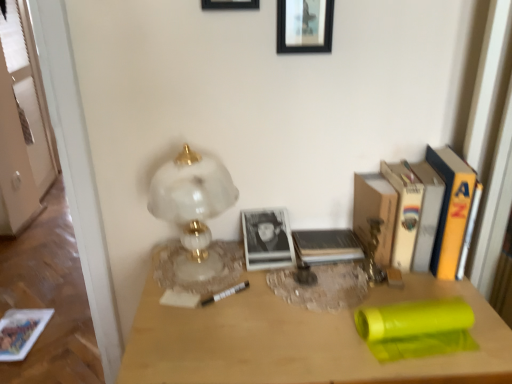
Where is `free location in front of white marble lamp at left`? free location in front of white marble lamp at left is located at coordinates (196, 322).